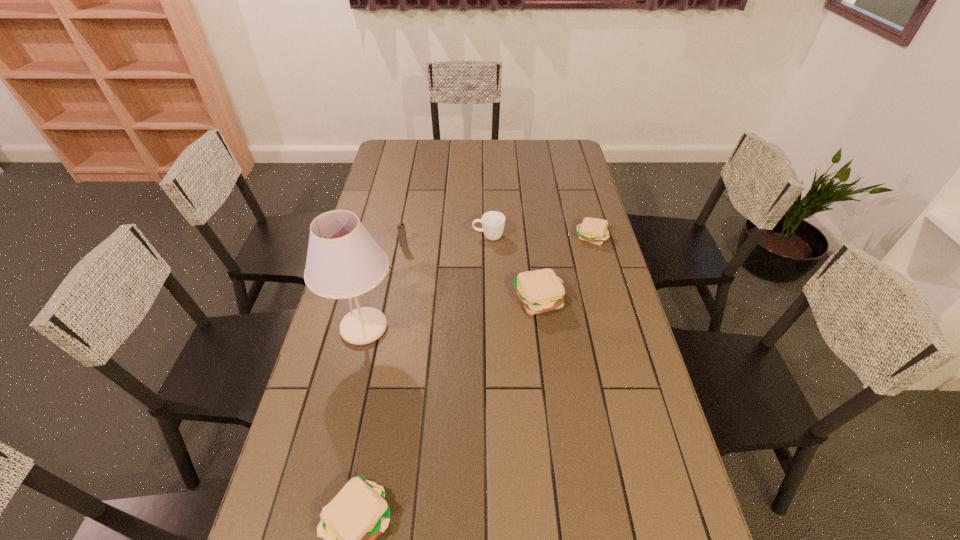
You are a GUI agent. You are given a task and a screenshot of the screen. Output one action in this format:
    pyautogui.click(x=<x>, y=<y>)
    Task: Click on the empty space between the lampshade and the fifth object from left to right
    Image resolution: width=960 pixels, height=540 pixels.
    Given the screenshot: What is the action you would take?
    pyautogui.click(x=451, y=314)

At what (x,y) coordinates should I click in order to perform the action: click on vacant area that lies between the igniter and the shortest patty. Please return your answer as a coordinate pair (x, y). This screenshot has height=540, width=960. Looking at the image, I should click on (497, 241).

This screenshot has height=540, width=960. In order to click on vacant area that lies between the shortest object and the second nearest patty in this screenshot , I will do `click(564, 268)`.

Where is `vacant point located between the fourth object from left to right and the second nearest patty`? vacant point located between the fourth object from left to right and the second nearest patty is located at coordinates (514, 268).

Locate an element on the screen. The image size is (960, 540). unoccupied area between the rightmost patty and the second object from right to left is located at coordinates (564, 268).

Find the location of a particular element. The height and width of the screenshot is (540, 960). unoccupied area between the shortest patty and the second patty from left to right is located at coordinates (564, 268).

Locate which object ranks second in proximity to the farthest patty. Please provide its 2D coordinates. Your answer should be formatted as a tuple, i.e. [(x, y)], where the tuple contains the x and y coordinates of a point satisfying the conditions above.

[(493, 222)]

The width and height of the screenshot is (960, 540). Find the location of `object identified as the closest to the rightmost patty`. object identified as the closest to the rightmost patty is located at coordinates (539, 291).

Identify which patty is the second closest to the third object from right to left. Please provide its 2D coordinates. Your answer should be formatted as a tuple, i.e. [(x, y)], where the tuple contains the x and y coordinates of a point satisfying the conditions above.

[(592, 230)]

Point out which patty is positioned as the third nearest to the igniter. Please provide its 2D coordinates. Your answer should be formatted as a tuple, i.e. [(x, y)], where the tuple contains the x and y coordinates of a point satisfying the conditions above.

[(350, 523)]